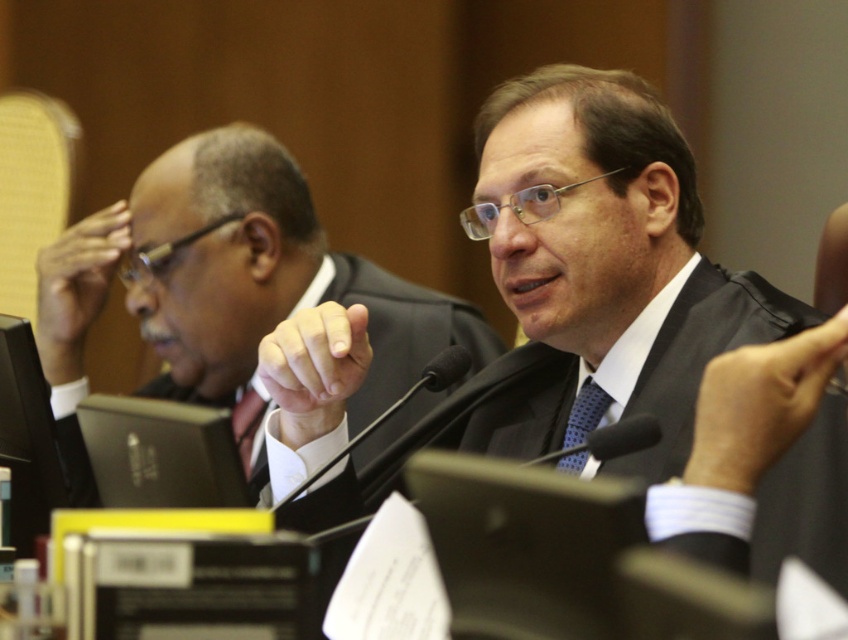
You are organizing a formal event and need to ensure all attire meets specific size requirements. Given the description of the matte black suit at left and the blue dotted tie at center, which item would require a larger storage space based on their widths?

The matte black suit at left is wider than the blue dotted tie at center, so it would require a larger storage space based on their widths.

Consider the image. You are standing in front of the image and want to locate the matte black suit at center. Which coordinate point would you look towards?

The matte black suit at center is located at coordinate point (646,328).